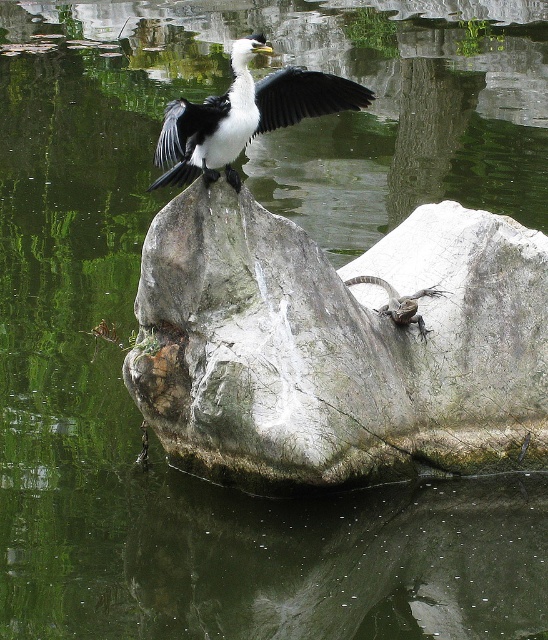
Question: Does gray stone boulder at center have a greater width compared to white-feathered bird with black wings at center?

Choices:
 (A) yes
 (B) no

Answer: (A)

Question: Which object is closer to the camera taking this photo?

Choices:
 (A) black feathered wing at upper center
 (B) gray stone boulder at center
 (C) white-feathered bird with black wings at center

Answer: (C)

Question: Which point appears closest to the camera in this image?

Choices:
 (A) (265, 122)
 (B) (476, 289)

Answer: (A)

Question: Does white-feathered bird with black wings at center have a smaller size compared to black feathered wing at upper center?

Choices:
 (A) no
 (B) yes

Answer: (A)

Question: Based on their relative distances, which object is farther from the gray stone boulder at center?

Choices:
 (A) white-feathered bird with black wings at center
 (B) black feathered wing at upper center

Answer: (B)

Question: Does white-feathered bird with black wings at center have a greater width compared to black feathered wing at upper center?

Choices:
 (A) no
 (B) yes

Answer: (B)